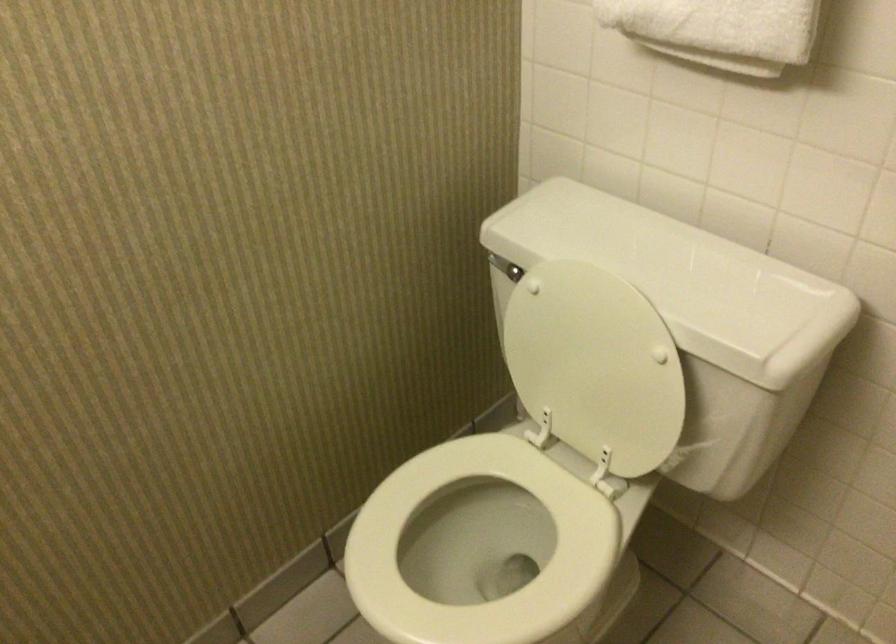
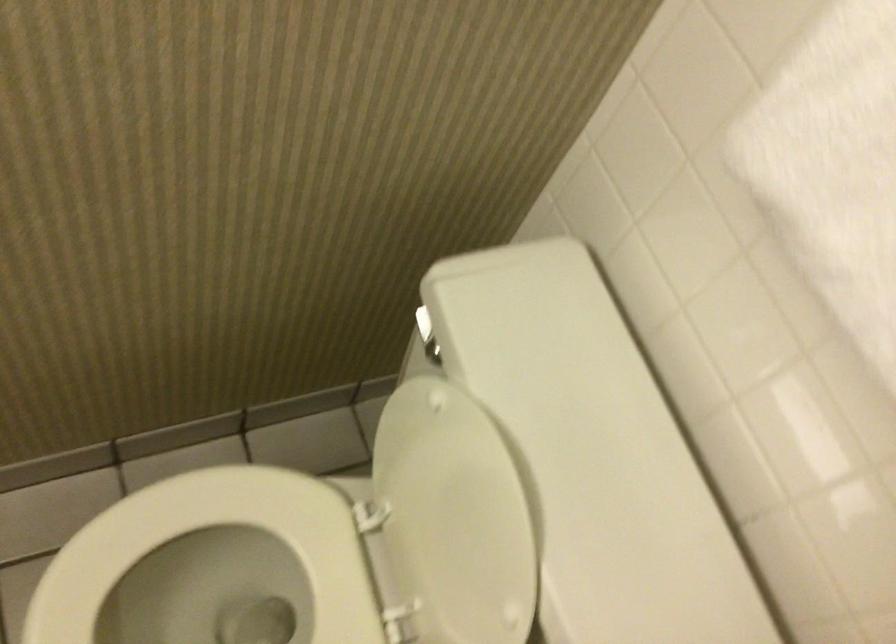
Locate, in the second image, the point that corresponds to [591,346] in the first image.

(453, 518)